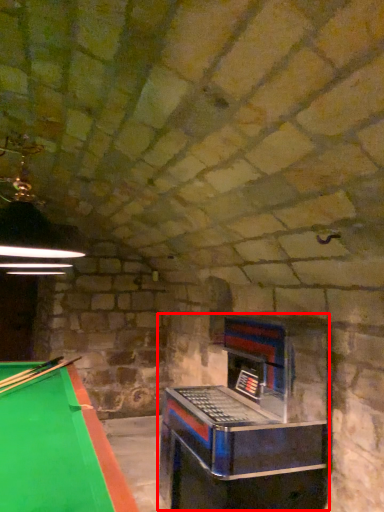
Question: Considering the relative positions of slot machine (annotated by the red box) and cue in the image provided, where is slot machine (annotated by the red box) located with respect to the staircase?

Choices:
 (A) left
 (B) right

Answer: (B)